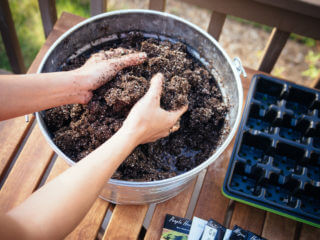
You are a GUI agent. You are given a task and a screenshot of the screen. Output one action in this format:
    pyautogui.click(x=<x>, y=<y>)
    Task: Click on the planter
    Image resolution: width=320 pixels, height=240 pixels.
    Given the screenshot: What is the action you would take?
    pyautogui.click(x=267, y=133)